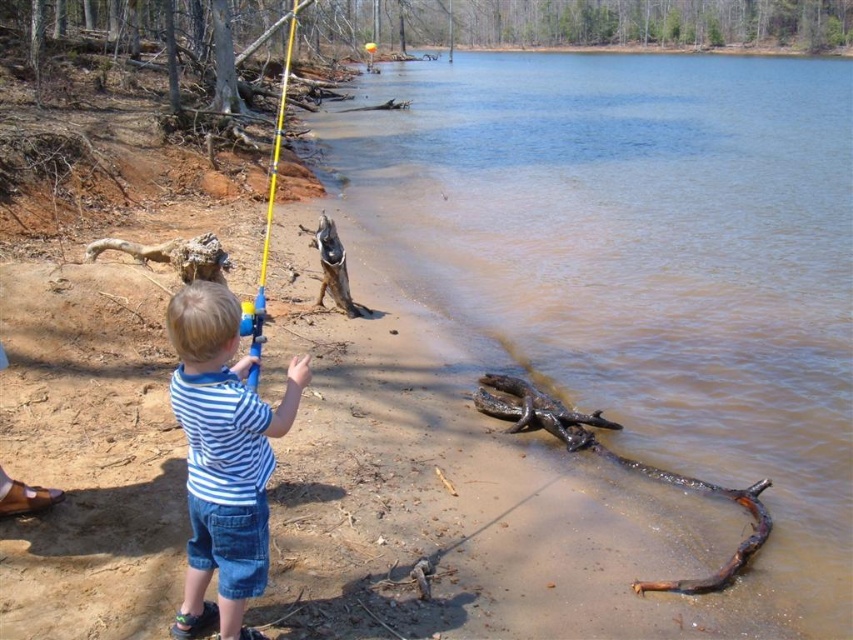
You are a parent supervising your child at the lakeside. You notice the brown muddy water at lower center and the brown rough log at lower right. Which object should you warn your child to avoid stepping on to prevent slipping?

You should warn your child to avoid stepping on the brown muddy water at lower center because it is bigger and more likely to be slippery compared to the brown rough log at lower right.